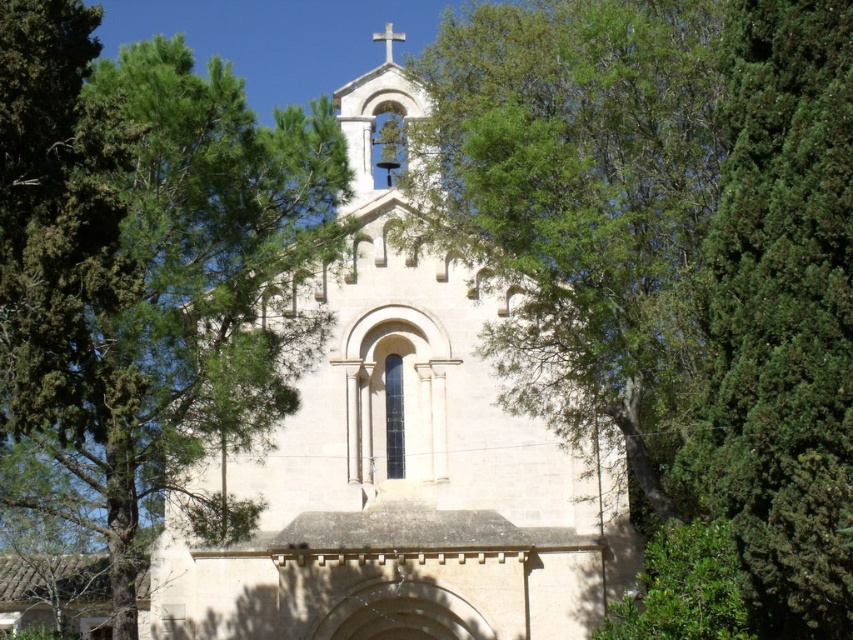
You are a photographer planning to take a picture of the white stone church at center. However, there is a green leafy tree at center blocking part of the church. Based on their sizes, which object should you move closer to in order to fully capture the church in the frame?

The green leafy tree at center has a smaller size compared to the white stone church at center. To fully capture the church in the frame, you should move closer to the white stone church at center so that its larger size can dominate the frame and minimize the obstruction from the smaller tree.

You are standing in front of the church and notice two points marked on the facade. The first point is at coordinate point (585,432) and the second is at point (297,410). Which of these points is closer to the cross at the top of the church?

Point (585,432) is behind point (297,410), so the point closer to the cross at the top of the church would be point (585,432) since it is positioned higher on the facade.